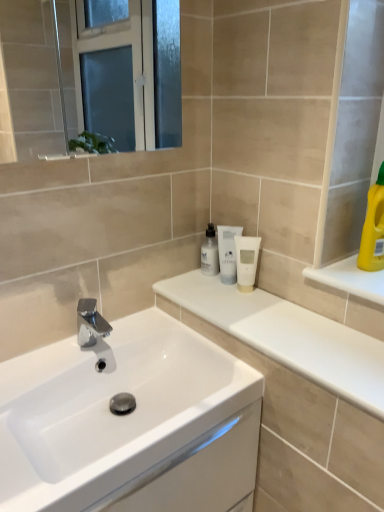
What are the coordinates of `vacant area located to the right-hand side of chrome/metallic faucet at center` in the screenshot? It's located at (153, 336).